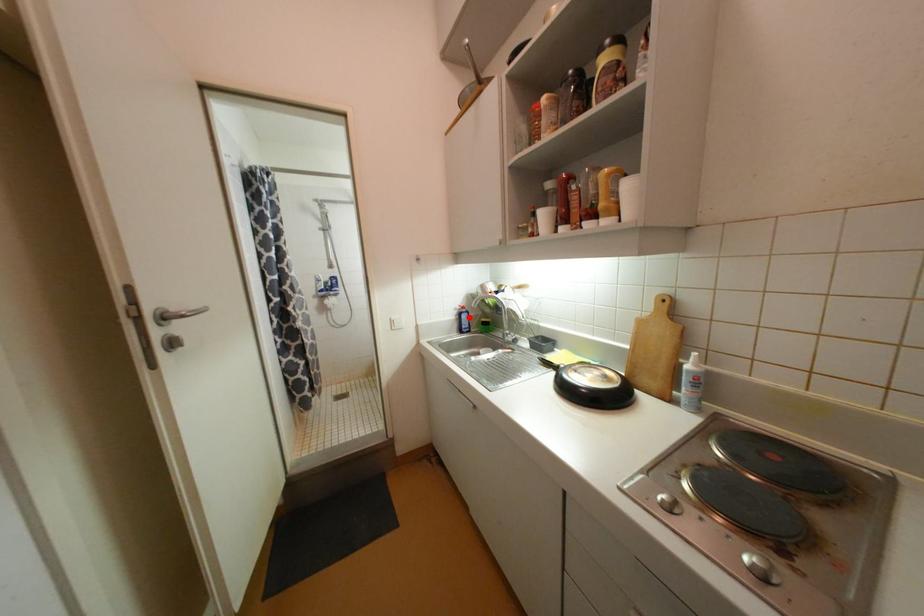
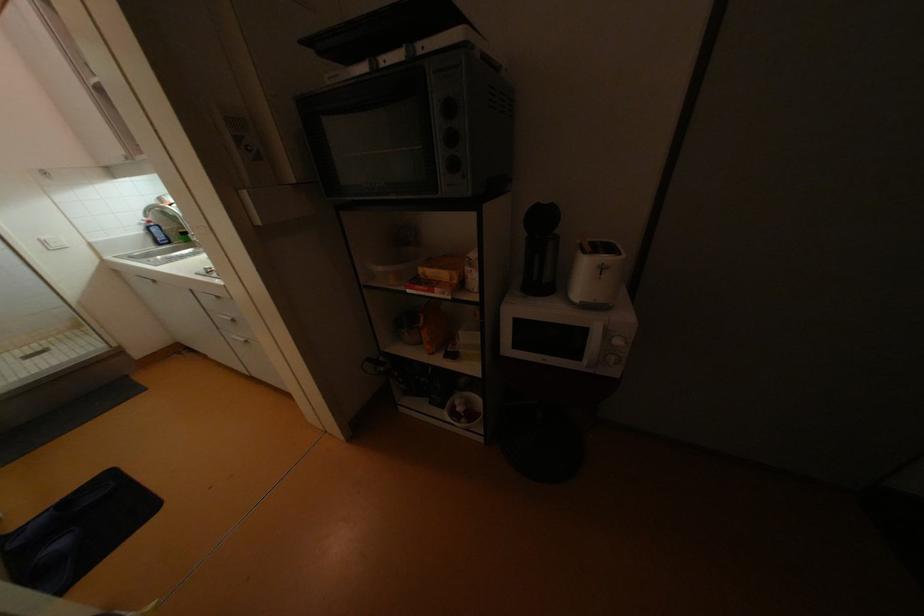
Where in the second image is the point corresponding to the highlighted location from the first image?

(160, 231)